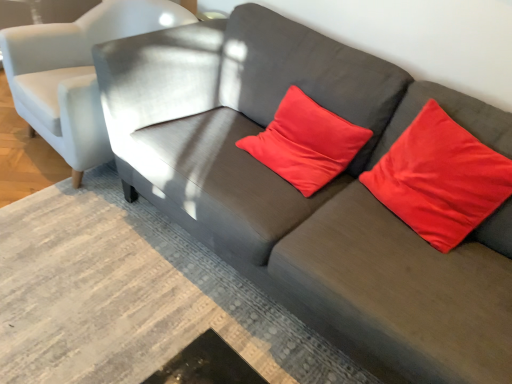
Question: Considering the positions of point (463, 163) and point (283, 130), is point (463, 163) closer or farther from the camera than point (283, 130)?

Choices:
 (A) farther
 (B) closer

Answer: (B)

Question: Is satin red pillow at upper right, acting as the first pillow starting from the right, to the left or to the right of satin red pillow at center, placed as the 2th pillow when sorted from right to left, in the image?

Choices:
 (A) right
 (B) left

Answer: (A)

Question: Considering the real-world distances, which object is closest to the satin red pillow at upper right, placed as the second pillow when sorted from left to right?

Choices:
 (A) satin red pillow at center, which is the first pillow from left to right
 (B) light gray fabric chair at upper left

Answer: (A)

Question: Which object is the farthest from the satin red pillow at upper right, placed as the second pillow when sorted from left to right?

Choices:
 (A) light gray fabric chair at upper left
 (B) satin red pillow at center, which is the first pillow from left to right

Answer: (A)